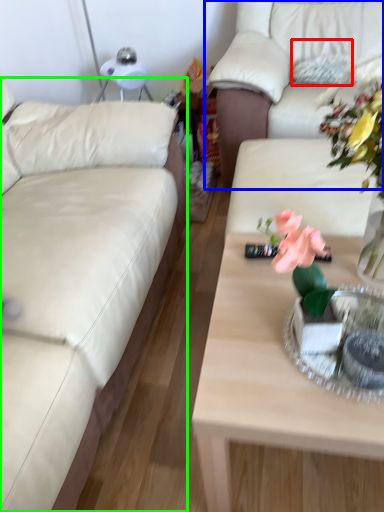
Question: Which is nearer to the pillow (highlighted by a red box)? studio couch (highlighted by a blue box) or studio couch (highlighted by a green box).

Choices:
 (A) studio couch
 (B) studio couch

Answer: (A)